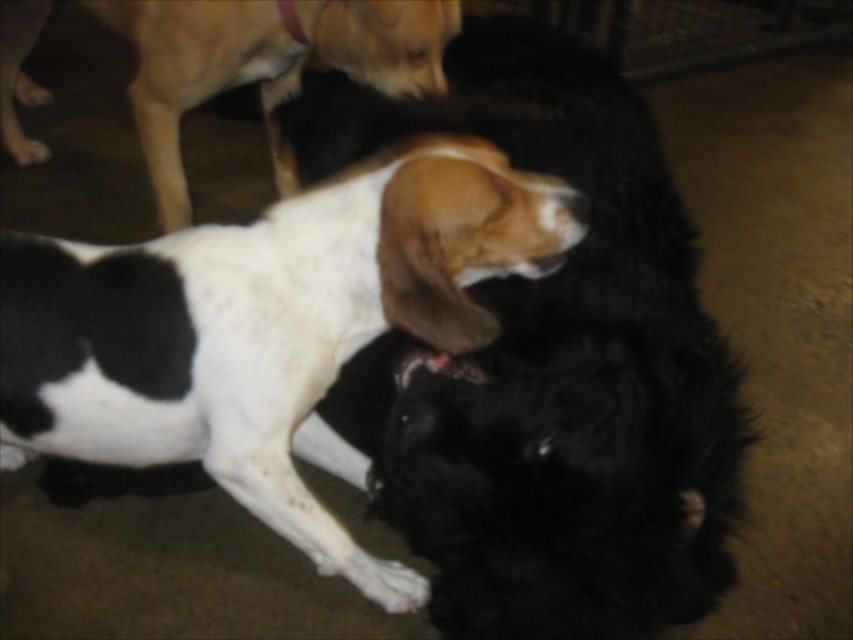
Based on the photo, you are standing in the room where the two dogs are interacting. You need to place a small treat between the two points marked as point [247,285] and point [149,60]. Which point should you place the treat closer to so that it is nearer to the viewer?

You should place the treat closer to point [247,285] because it is closer to the viewer than point [149,60].

You are standing in the room where the two dogs are interacting. You want to place a treat between the two points marked as point (456, 612) and point (10, 99). Which point should you place the treat closer to so that it is nearer to the viewer?

You should place the treat closer to point (456, 612) because it is closer to the viewer than point (10, 99).